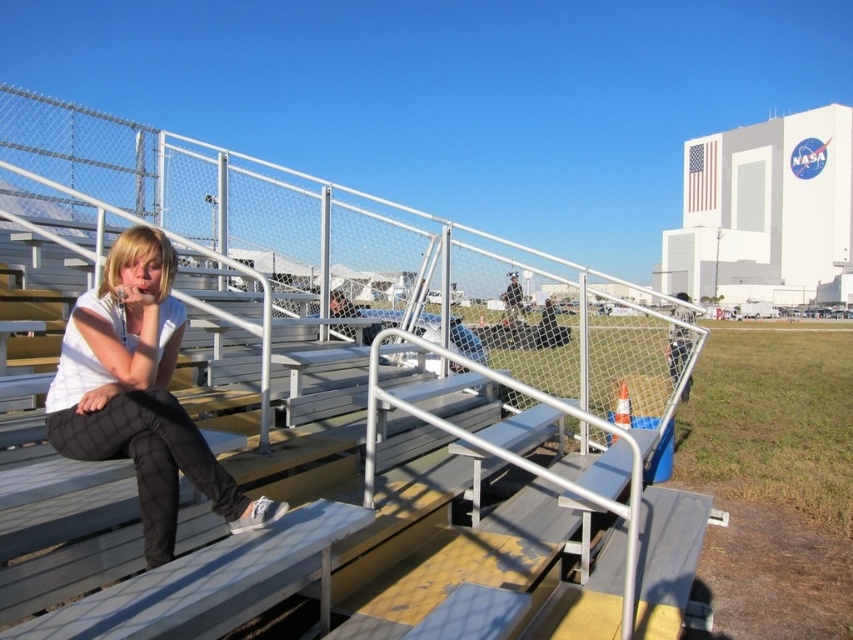
Question: Is metallic silver rail at center behind metallic gray bleachers at left?

Choices:
 (A) yes
 (B) no

Answer: (B)

Question: Which point is farther to the camera?

Choices:
 (A) (427, 392)
 (B) (184, 476)
 (C) (70, 209)

Answer: (C)

Question: Among these objects, which one is farthest from the camera?

Choices:
 (A) metallic silver rail at center
 (B) metallic gray bleachers at left
 (C) white matte shirt at center

Answer: (B)

Question: Does metallic silver rail at center have a larger size compared to metallic gray bleachers at left?

Choices:
 (A) no
 (B) yes

Answer: (B)

Question: In this image, where is metallic silver rail at center located relative to white matte shirt at center?

Choices:
 (A) left
 (B) right

Answer: (B)

Question: Which object is the closest to the metallic silver rail at center?

Choices:
 (A) metallic gray bleachers at left
 (B) white matte shirt at center

Answer: (B)